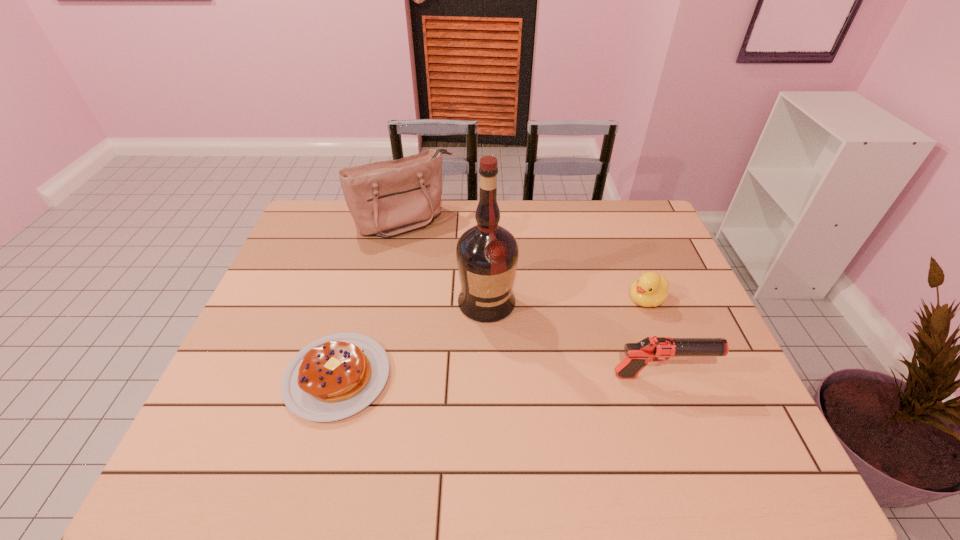
Where is `object that ranks as the closest to the shortest object`? Image resolution: width=960 pixels, height=540 pixels. object that ranks as the closest to the shortest object is located at coordinates (487, 254).

You are a GUI agent. You are given a task and a screenshot of the screen. Output one action in this format:
    pyautogui.click(x=<x>, y=<y>)
    Task: Click on the third closest object to the fourth shortest object
    
    Given the screenshot: What is the action you would take?
    pyautogui.click(x=651, y=289)

What are the coordinates of `free spot that satisfies the following two spatial constraints: 1. on the back side of the second shortest object; 2. on the left side of the pancake` in the screenshot? It's located at (359, 300).

At what (x,y) coordinates should I click in order to perform the action: click on vacant space that satisfies the following two spatial constraints: 1. on the front side of the liquor; 2. at the aiming end of the gun. Please return your answer as a coordinate pair (x, y). Looking at the image, I should click on (488, 376).

In order to click on vacant space that satisfies the following two spatial constraints: 1. on the back side of the shortest object; 2. on the right side of the shoulder bag in this screenshot , I will do `click(381, 221)`.